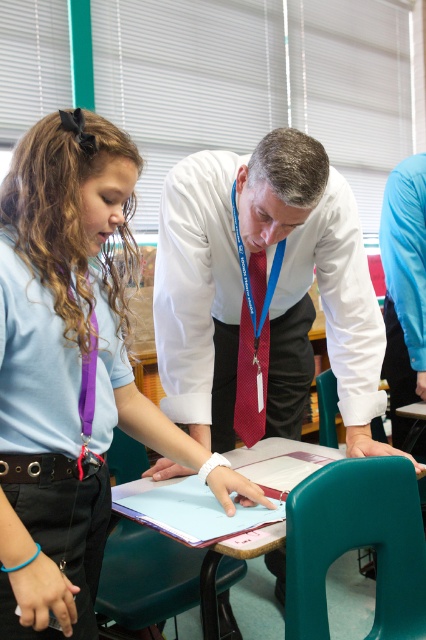
You are standing in the classroom and need to locate the white glossy shirt at center and the black leather belt at center. From your perspective, which object is positioned more to the right?

The white glossy shirt at center is positioned more to the right than the black leather belt at center.

You are a tailor observing the shiny red tie at center and the black leather belt at center. Which object is taller?

The shiny red tie at center is taller than the black leather belt at center.

You are a student observing the scene. The teacher is wearing a white glossy shirt at center and a black leather belt at center. Which clothing item is positioned higher on the teacher?

The white glossy shirt at center is located above the black leather belt at center, so the white glossy shirt at center is positioned higher on the teacher.